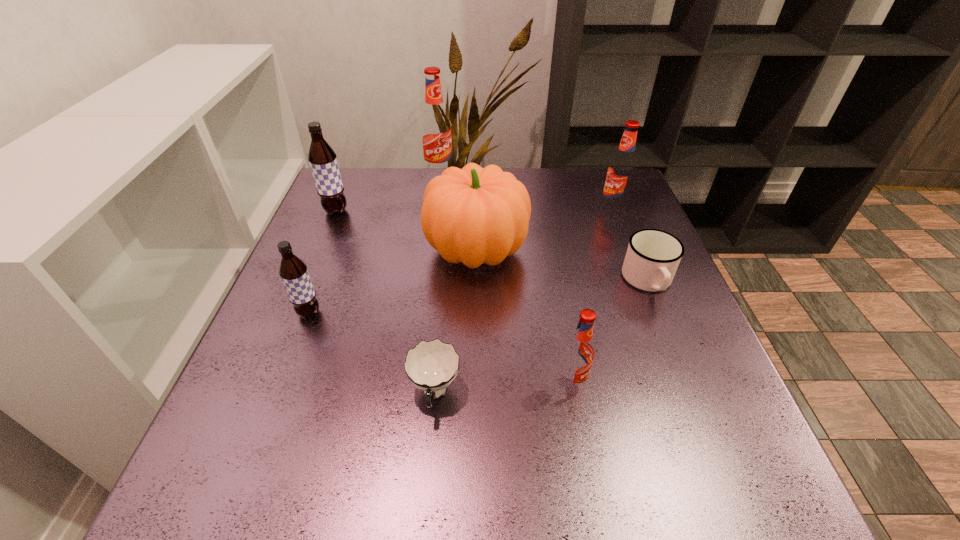
Locate an element on the screen. root beer that is the third closest one to the nearer brown root beer is located at coordinates (435, 124).

Locate an element on the screen. The height and width of the screenshot is (540, 960). root beer that stands as the second closest to the farther brown root beer is located at coordinates (293, 271).

Identify which red root beer is the closest to the second smallest red root beer. Please provide its 2D coordinates. Your answer should be formatted as a tuple, i.e. [(x, y)], where the tuple contains the x and y coordinates of a point satisfying the conditions above.

[(435, 124)]

Identify which red root beer is the third closest to the bigger brown root beer. Please provide its 2D coordinates. Your answer should be formatted as a tuple, i.e. [(x, y)], where the tuple contains the x and y coordinates of a point satisfying the conditions above.

[(579, 351)]